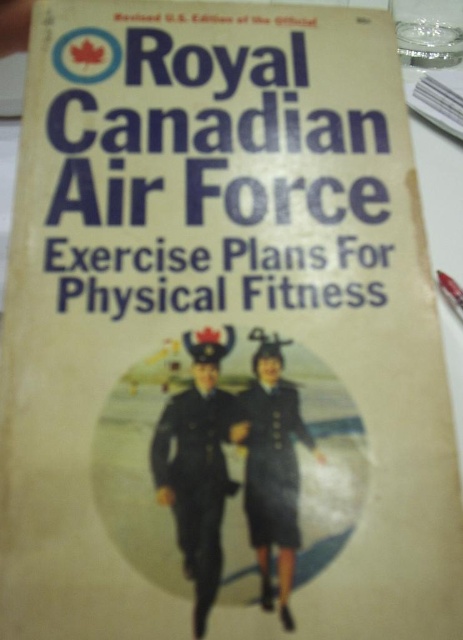
From the picture: Is dark blue uniform at center positioned in front of dark blue woolen dress at center?

Yes.

In the scene shown: Does dark blue uniform at center appear under dark blue woolen dress at center?

Indeed, dark blue uniform at center is positioned under dark blue woolen dress at center.

Does point (182, 396) come in front of point (273, 476)?

That is False.

Where is `dark blue uniform at center`? The height and width of the screenshot is (640, 463). dark blue uniform at center is located at coordinates (199, 465).